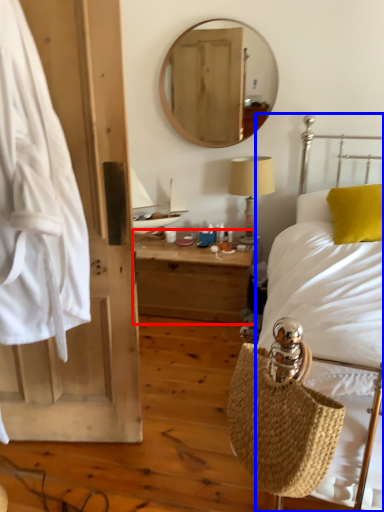
Question: Which object is closer to the camera taking this photo, nightstand (highlighted by a red box) or bed (highlighted by a blue box)?

Choices:
 (A) nightstand
 (B) bed

Answer: (B)